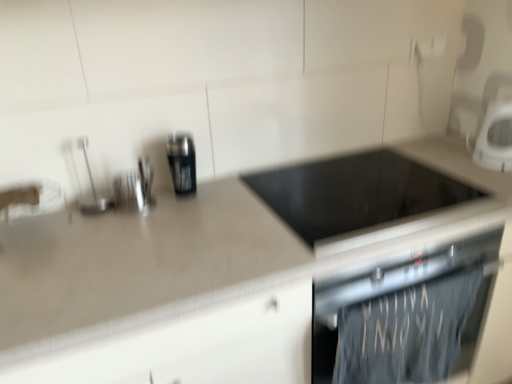
You are a GUI agent. You are given a task and a screenshot of the screen. Output one action in this format:
    pyautogui.click(x=<x>, y=<y>)
    Task: Click on the free space above beige laminate countertop at center (from a real-world perspective)
    The width and height of the screenshot is (512, 384).
    Given the screenshot: What is the action you would take?
    pyautogui.click(x=230, y=218)